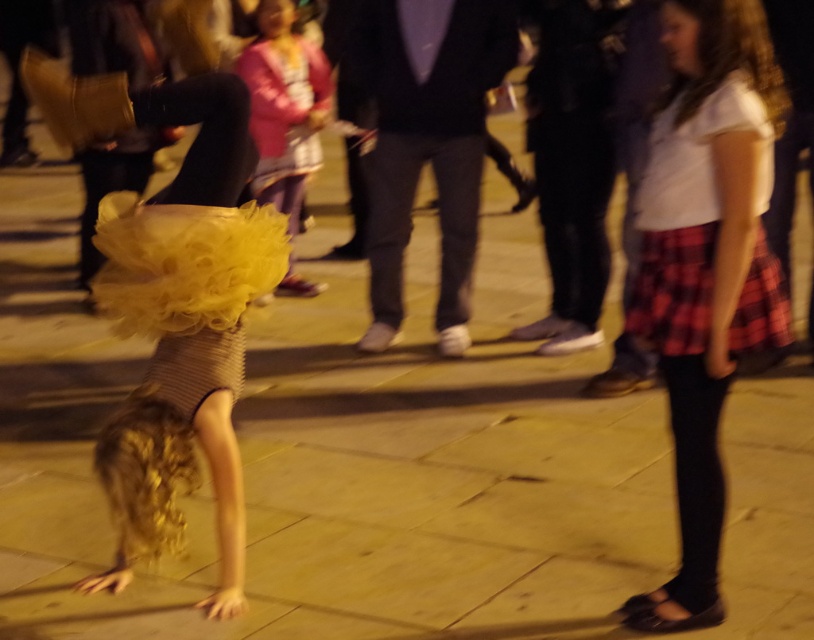
Question: Considering the relative positions of white cotton shirt at upper right and matte black leotard at center in the image provided, where is white cotton shirt at upper right located with respect to matte black leotard at center?

Choices:
 (A) right
 (B) left

Answer: (A)

Question: Does dark blue suit at center appear on the right side of matte black leotard at center?

Choices:
 (A) no
 (B) yes

Answer: (A)

Question: Which object is farther from the camera taking this photo?

Choices:
 (A) matte pink sweater at center
 (B) white cotton shirt at upper right
 (C) red plaid skirt at right

Answer: (A)

Question: Among these points, which one is nearest to the camera?

Choices:
 (A) (685, 346)
 (B) (392, 298)
 (C) (707, 83)
 (D) (274, 108)

Answer: (C)

Question: Which point is farther from the camera taking this photo?

Choices:
 (A) (556, 353)
 (B) (247, 61)
 (C) (670, 355)

Answer: (B)

Question: Is dark blue suit at center closer to the viewer compared to red plaid skirt at right?

Choices:
 (A) no
 (B) yes

Answer: (A)